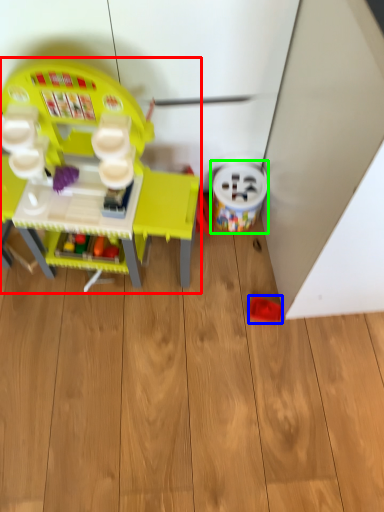
Question: Based on their relative distances, which object is farther from toy (highlighted by a red box)? Choose from toy (highlighted by a blue box) and toy (highlighted by a green box).

Choices:
 (A) toy
 (B) toy

Answer: (A)